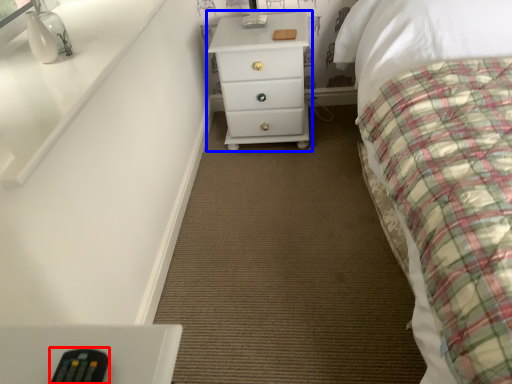
Question: Which of the following is the farthest to the observer, remote (highlighted by a red box) or chest of drawers (highlighted by a blue box)?

Choices:
 (A) remote
 (B) chest of drawers

Answer: (B)